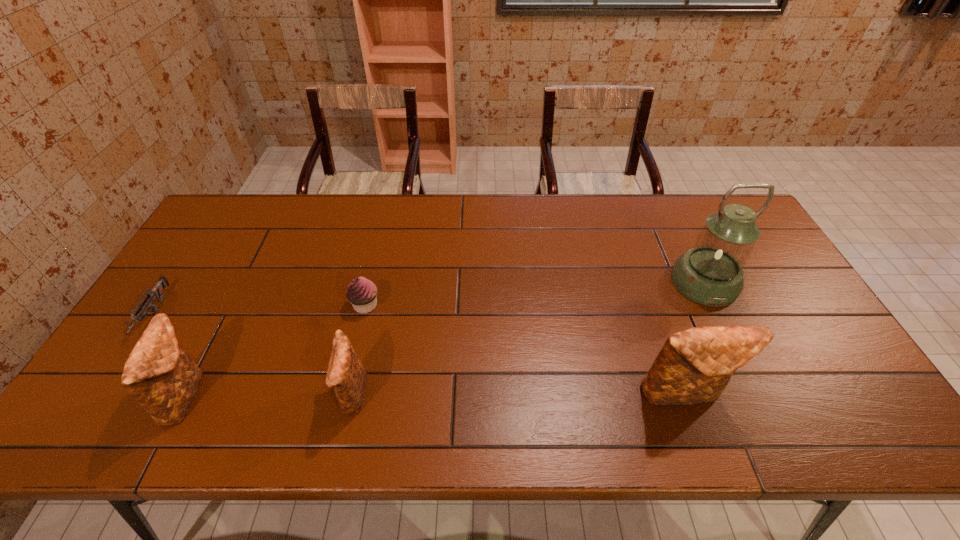
You are a GUI agent. You are given a task and a screenshot of the screen. Output one action in this format:
    pyautogui.click(x=<x>, y=<y>)
    Task: Click on the empty space that is in between the cupcake and the second tallest object
    The width and height of the screenshot is (960, 540).
    Given the screenshot: What is the action you would take?
    pyautogui.click(x=524, y=350)

Image resolution: width=960 pixels, height=540 pixels. Find the location of `vacant region between the fourth tallest object and the tallest object`. vacant region between the fourth tallest object and the tallest object is located at coordinates (528, 338).

Find the location of a particular element. vacant area that lies between the shortest clutch bag and the lantern is located at coordinates (528, 338).

Find the location of a particular element. The height and width of the screenshot is (540, 960). the closest object relative to the shortest clutch bag is located at coordinates (362, 293).

Identify which object is the nearest to the shortest object. Please provide its 2D coordinates. Your answer should be formatted as a tuple, i.e. [(x, y)], where the tuple contains the x and y coordinates of a point satisfying the conditions above.

[(161, 377)]

Identify which clutch bag is the second closest to the fourth shortest object. Please provide its 2D coordinates. Your answer should be formatted as a tuple, i.e. [(x, y)], where the tuple contains the x and y coordinates of a point satisfying the conditions above.

[(694, 366)]

Identify which clutch bag is the nearest to the third shortest object. Please provide its 2D coordinates. Your answer should be formatted as a tuple, i.e. [(x, y)], where the tuple contains the x and y coordinates of a point satisfying the conditions above.

[(161, 377)]

This screenshot has width=960, height=540. I want to click on free location that satisfies the following two spatial constraints: 1. on the open side of the tallest clutch bag; 2. on the open side of the leftmost clutch bag, so click(684, 395).

Where is `vacant point that satisfies the following two spatial constraints: 1. on the open side of the tallest clutch bag; 2. on the open side of the second shortest clutch bag`? vacant point that satisfies the following two spatial constraints: 1. on the open side of the tallest clutch bag; 2. on the open side of the second shortest clutch bag is located at coordinates (684, 395).

The width and height of the screenshot is (960, 540). I want to click on free spot that satisfies the following two spatial constraints: 1. on the open side of the second tallest object; 2. on the open side of the shortest clutch bag, so (684, 395).